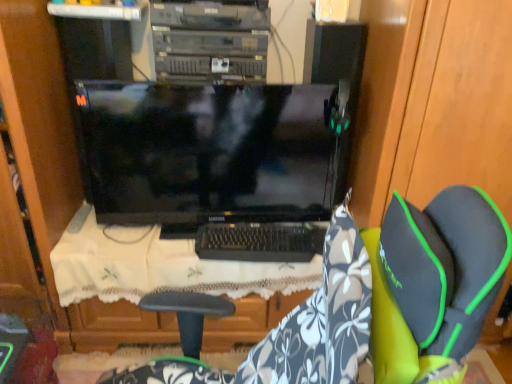
Question: Is the position of black plastic keyboard at center more distant than that of floral fabric chair at center?

Choices:
 (A) yes
 (B) no

Answer: (A)

Question: Is black plastic keyboard at center wider than floral fabric chair at center?

Choices:
 (A) no
 (B) yes

Answer: (A)

Question: Considering the relative sizes of black plastic keyboard at center and floral fabric chair at center in the image provided, is black plastic keyboard at center thinner than floral fabric chair at center?

Choices:
 (A) no
 (B) yes

Answer: (B)

Question: Can you confirm if black plastic keyboard at center is smaller than floral fabric chair at center?

Choices:
 (A) no
 (B) yes

Answer: (B)

Question: Would you consider black plastic keyboard at center to be distant from floral fabric chair at center?

Choices:
 (A) no
 (B) yes

Answer: (A)

Question: Considering the relative sizes of black plastic keyboard at center and floral fabric chair at center in the image provided, is black plastic keyboard at center bigger than floral fabric chair at center?

Choices:
 (A) yes
 (B) no

Answer: (B)

Question: Is wooden dresser at left next to floral fabric chair at center?

Choices:
 (A) no
 (B) yes

Answer: (A)

Question: Can you confirm if wooden dresser at left is positioned to the right of floral fabric chair at center?

Choices:
 (A) no
 (B) yes

Answer: (A)

Question: From the image's perspective, is wooden dresser at left beneath floral fabric chair at center?

Choices:
 (A) no
 (B) yes

Answer: (A)

Question: Is the depth of wooden dresser at left less than that of floral fabric chair at center?

Choices:
 (A) no
 (B) yes

Answer: (A)

Question: Considering the relative sizes of wooden dresser at left and floral fabric chair at center in the image provided, is wooden dresser at left wider than floral fabric chair at center?

Choices:
 (A) yes
 (B) no

Answer: (A)

Question: From a real-world perspective, does wooden dresser at left sit lower than floral fabric chair at center?

Choices:
 (A) yes
 (B) no

Answer: (A)

Question: Is black plastic keyboard at center completely or partially inside wooden dresser at left?

Choices:
 (A) no
 (B) yes

Answer: (A)